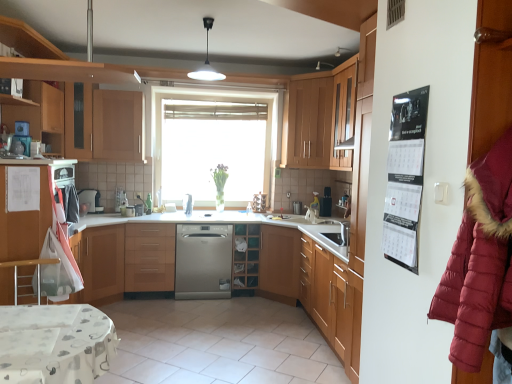
Identify the location of wooden cabinet at upper center, which is the 2th cabinetry from right to left. The width and height of the screenshot is (512, 384). (318, 117).

Describe the element at coordinates (318, 117) in the screenshot. The width and height of the screenshot is (512, 384). I see `wooden cabinet at upper center, which is the 2th cabinetry from right to left` at that location.

This screenshot has height=384, width=512. What do you see at coordinates (27, 265) in the screenshot?
I see `metallic silver bar stool at lower left` at bounding box center [27, 265].

Locate an element on the screen. The width and height of the screenshot is (512, 384). white plastic table at lower left is located at coordinates (55, 343).

What do you see at coordinates (55, 343) in the screenshot? The image size is (512, 384). I see `white plastic table at lower left` at bounding box center [55, 343].

The width and height of the screenshot is (512, 384). What do you see at coordinates (259, 203) in the screenshot? I see `satin silver dishwasher at center, acting as the first appliance starting from the back` at bounding box center [259, 203].

Measure the distance between point (255,197) and camera.

They are 5.59 meters apart.

Find the location of a particular element. This screenshot has height=384, width=512. wooden cabinet at upper center, the fourth cabinetry when ordered from left to right is located at coordinates (318, 117).

Based on the photo, considering the relative sizes of wooden cabinet at center, the third cabinetry when ordered from right to left, and wooden cabinet at upper right, which appears as the fifth cabinetry when viewed from the left, in the image provided, is wooden cabinet at center, the third cabinetry when ordered from right to left, shorter than wooden cabinet at upper right, which appears as the fifth cabinetry when viewed from the left,?

Yes.

Looking at their sizes, would you say wooden cabinet at center, the third cabinetry when ordered from right to left, is wider or thinner than wooden cabinet at upper right, which appears as the fifth cabinetry when viewed from the left?

wooden cabinet at center, the third cabinetry when ordered from right to left, is wider than wooden cabinet at upper right, which appears as the fifth cabinetry when viewed from the left.

Locate an element on the screen. This screenshot has height=384, width=512. the 2nd cabinetry to the right of the wooden cabinet at center, positioned as the third cabinetry in left-to-right order, starting your count from the anchor is located at coordinates (343, 115).

Based on the photo, is wooden cabinet at upper right, which appears as the fifth cabinetry when viewed from the left, next to satin silver dishwasher at center, which is the second appliance in left-to-right order, and touching it?

No.

Is wooden cabinet at upper right, marked as the first cabinetry in a right-to-left arrangement, facing away from satin silver dishwasher at center, the second appliance from the front?

wooden cabinet at upper right, marked as the first cabinetry in a right-to-left arrangement, does not have its back to satin silver dishwasher at center, the second appliance from the front.

Is wooden cabinet at upper right, marked as the first cabinetry in a right-to-left arrangement, wider than satin silver dishwasher at center, the third appliance positioned from the right?

Yes, wooden cabinet at upper right, marked as the first cabinetry in a right-to-left arrangement, is wider than satin silver dishwasher at center, the third appliance positioned from the right.

Would you say metallic silver bar stool at lower left is a long distance from wooden cabinet at upper center, which is the 2th cabinetry from right to left?

Yes, metallic silver bar stool at lower left and wooden cabinet at upper center, which is the 2th cabinetry from right to left, are quite far apart.

Considering the positions of objects metallic silver bar stool at lower left and wooden cabinet at upper center, which is the 2th cabinetry from right to left, in the image provided, who is in front, metallic silver bar stool at lower left or wooden cabinet at upper center, which is the 2th cabinetry from right to left,?

metallic silver bar stool at lower left is closer to the camera.

Would you say metallic silver bar stool at lower left is to the left or to the right of wooden cabinet at upper center, the fourth cabinetry when ordered from left to right, in the picture?

metallic silver bar stool at lower left is to the left of wooden cabinet at upper center, the fourth cabinetry when ordered from left to right.

Which object is wider, metallic silver bar stool at lower left or wooden cabinet at upper center, which is the 2th cabinetry from right to left?

With larger width is wooden cabinet at upper center, which is the 2th cabinetry from right to left.

Between metallic silver bar stool at lower left and white glossy light fixture at upper center, which one appears on the right side from the viewer's perspective?

Positioned to the right is white glossy light fixture at upper center.

Which object is further away from the camera taking this photo, metallic silver bar stool at lower left or white glossy light fixture at upper center?

white glossy light fixture at upper center is behind.

Is point (41, 262) in front of point (191, 76)?

Yes, point (41, 262) is closer to viewer.

Is metallic silver bar stool at lower left wider or thinner than white glossy light fixture at upper center?

Considering their sizes, metallic silver bar stool at lower left looks broader than white glossy light fixture at upper center.

Between black plastic toaster at center, acting as the 4th appliance starting from the left, and wooden cabinet at upper center, placed as the 2th cabinetry when sorted from left to right, which one has smaller width?

Thinner between the two is black plastic toaster at center, acting as the 4th appliance starting from the left.

Is wooden cabinet at upper center, the fourth cabinetry in the right-to-left sequence, inside black plastic toaster at center, acting as the 4th appliance starting from the left?

Actually, wooden cabinet at upper center, the fourth cabinetry in the right-to-left sequence, is outside black plastic toaster at center, acting as the 4th appliance starting from the left.

Based on their positions, is black plastic toaster at center, arranged as the 2th appliance when viewed from the back, located to the left or right of wooden cabinet at upper center, the fourth cabinetry in the right-to-left sequence?

black plastic toaster at center, arranged as the 2th appliance when viewed from the back, is to the right of wooden cabinet at upper center, the fourth cabinetry in the right-to-left sequence.

Is satin stainless steel dishwasher at center with satin silver dishwasher at center, the third appliance positioned from the right?

No, satin stainless steel dishwasher at center is not beside satin silver dishwasher at center, the third appliance positioned from the right.

From the image's perspective, does satin stainless steel dishwasher at center appear lower than satin silver dishwasher at center, the second appliance from the front?

Yes.

In terms of size, does satin stainless steel dishwasher at center appear bigger or smaller than satin silver dishwasher at center, the third appliance positioned from the right?

Considering their sizes, satin stainless steel dishwasher at center takes up more space than satin silver dishwasher at center, the third appliance positioned from the right.

Is satin silver dishwasher at center, the third appliance viewed from the back, at the back of satin stainless steel dishwasher at center?

No, satin stainless steel dishwasher at center is not facing the opposite direction of satin silver dishwasher at center, the third appliance viewed from the back.

The image size is (512, 384). Identify the location of the 1st cabinetry in front when counting from the satin stainless steel dishwasher at center. (318, 117).

Consider the image. From the image's perspective, between wooden cabinet at upper center, which is the 2th cabinetry from right to left, and satin stainless steel dishwasher at center, which one is located above?

wooden cabinet at upper center, which is the 2th cabinetry from right to left, is shown above in the image.

Choose the correct answer: Is wooden cabinet at upper center, the fourth cabinetry when ordered from left to right, inside satin stainless steel dishwasher at center or outside it?

The correct answer is: outside.

I want to click on the 2nd cabinetry counting from the right side of the wooden cabinet at center, the third cabinetry when ordered from right to left, so click(343, 115).

What are the coordinates of `appliance that is the 3rd object directly below the wooden cabinet at upper right, which appears as the fifth cabinetry when viewed from the left (from a real-world perspective)` in the screenshot? It's located at (188, 204).

From the image, which object appears to be farther from black glossy calendar at right, translucent glass window at center or white glossy refrigerator at left, marked as the 1th cabinetry in a left-to-right arrangement?

translucent glass window at center lies further to black glossy calendar at right than the other object.

Considering their positions, is translucent glass window at center positioned further to metallic silver bar stool at lower left than satin silver dishwasher at center, which is counted as the 1th appliance, starting from the front?

translucent glass window at center.

Considering their positions, is white glossy refrigerator at left, which is the fifth cabinetry from right to left, positioned further to black plastic toaster at center, acting as the 4th appliance starting from the left, than satin stainless steel dishwasher at center?

Based on the image, white glossy refrigerator at left, which is the fifth cabinetry from right to left, appears to be further to black plastic toaster at center, acting as the 4th appliance starting from the left.

When comparing their distances from burgundy puffy coat at right, does satin stainless steel dishwasher at center or black plastic toaster at center, which is the first appliance in right-to-left order, seem further?

Among the two, black plastic toaster at center, which is the first appliance in right-to-left order, is located further to burgundy puffy coat at right.

Looking at the image, which one is located closer to translucent glass window at center, burgundy puffy coat at right or white plastic table at lower left?

The object closer to translucent glass window at center is white plastic table at lower left.

Which object lies further to the anchor point satin silver dishwasher at center, acting as the first appliance starting from the back, burgundy puffy coat at right or wooden cabinet at center, positioned as the third cabinetry in left-to-right order?

burgundy puffy coat at right.

Which object lies nearer to the anchor point white plastic table at lower left, wooden cabinet at center, the third cabinetry when ordered from right to left, or wooden cabinet at upper center, the fourth cabinetry in the right-to-left sequence?

wooden cabinet at center, the third cabinetry when ordered from right to left, lies closer to white plastic table at lower left than the other object.

When comparing their distances from black plastic toaster at center, arranged as the 2th appliance when viewed from the back, does white glossy light fixture at upper center or metallic silver bar stool at lower left seem further?

metallic silver bar stool at lower left is positioned further to the anchor black plastic toaster at center, arranged as the 2th appliance when viewed from the back.

Identify the location of window located between wooden cabinet at upper center, the fourth cabinetry in the right-to-left sequence, and wooden cabinet at upper center, the fourth cabinetry when ordered from left to right, in the left-right direction. (212, 145).

The image size is (512, 384). Identify the location of shelf located between wooden cabinet at upper center, placed as the 2th cabinetry when sorted from left to right, and wooden cabinet at upper right, marked as the first cabinetry in a right-to-left arrangement, in the left-right direction. (246, 255).

Identify the location of light fixture between white glossy refrigerator at left, which is the fifth cabinetry from right to left, and translucent glass window at center, along the z-axis. This screenshot has width=512, height=384. (206, 61).

The height and width of the screenshot is (384, 512). I want to click on bar stool between white plastic table at lower left and black plastic toaster at center, arranged as the 2th appliance when viewed from the back, in the front-back direction, so click(27, 265).